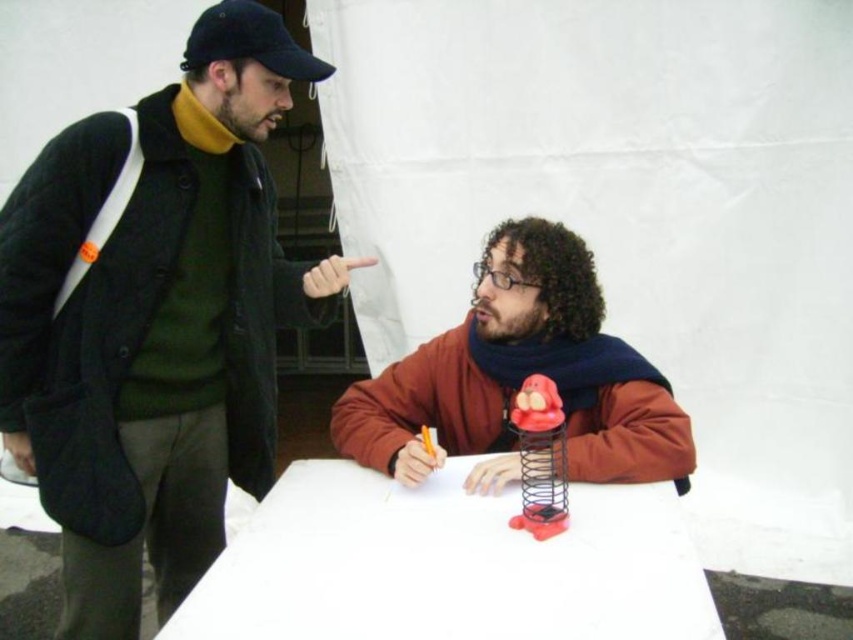
You are a photographer trying to capture a closeup of the white paper at center and the matte orange jacket at center in the scene described. Since you want both objects to be clearly visible in the photo, which object should you focus on first to ensure proper focus, considering their sizes?

The white paper at center is shorter than matte orange jacket at center, so you should focus on the matte orange jacket at center first because larger objects require focusing on their central area to ensure clarity.

You are a photographer trying to capture a candid shot of the two people in the scene. To ensure the matte orange jacket at center and the rubberized plastic spring at center are both in focus, which object should you focus on first? Please explain your reasoning based on their positions.

The matte orange jacket at center is above the rubberized plastic spring at center. Since the jacket is higher up, focusing on the jacket first would likely keep both objects in focus as the spring is below it within the same plane.